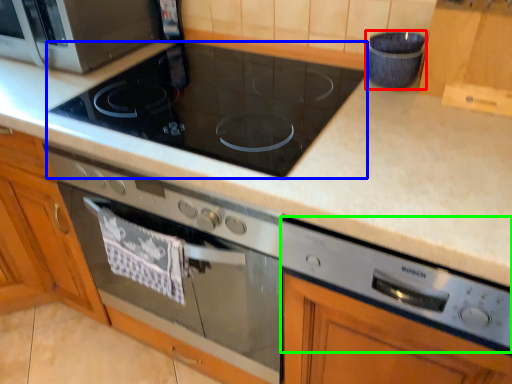
Question: Which object is positioned farthest from appliance (highlighted by a red box)? Select from gas stove (highlighted by a blue box) and appliance (highlighted by a green box).

Choices:
 (A) gas stove
 (B) appliance

Answer: (B)